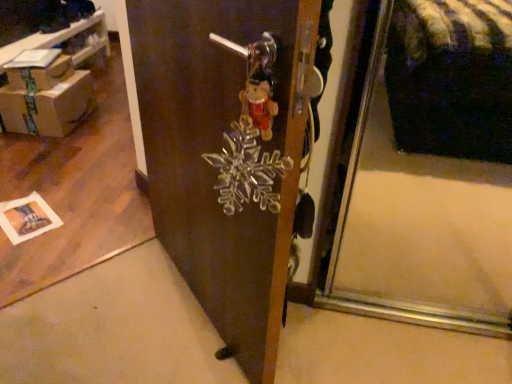
Image resolution: width=512 pixels, height=384 pixels. What do you see at coordinates (228, 154) in the screenshot?
I see `transparent glass snowflake at center` at bounding box center [228, 154].

What is the approximate width of brown cardboard box at upper left?

11.80 inches.

What are the coordinates of `transparent glass snowflake at center` in the screenshot? It's located at (228, 154).

In order to click on table below the brown cardboard box at upper left (from a real-world perspective) in this screenshot , I will do `click(61, 40)`.

From the picture: Between brown cardboard box at upper left and brown cardboard boxes at left, which one has smaller width?

With smaller width is brown cardboard box at upper left.

Is brown cardboard box at upper left next to brown cardboard boxes at left?

brown cardboard box at upper left and brown cardboard boxes at left are not in contact.

Looking at this image, considering the sizes of objects brown cardboard box at upper left and brown cardboard boxes at left in the image provided, who is smaller, brown cardboard box at upper left or brown cardboard boxes at left?

brown cardboard box at upper left is smaller.

Is transparent glass snowflake at center facing towards brown cardboard box at upper left?

No.

Identify the location of cardboard box that is under the transparent glass snowflake at center (from a real-world perspective). The height and width of the screenshot is (384, 512). (42, 74).

Can you confirm if transparent glass snowflake at center is bigger than brown cardboard box at upper left?

Correct, transparent glass snowflake at center is larger in size than brown cardboard box at upper left.

From the image's perspective, is transparent glass snowflake at center positioned above or below brown cardboard box at upper left?

Clearly, from the image's perspective, transparent glass snowflake at center is below brown cardboard box at upper left.

Can you tell me how much brown cardboard box at upper left and cardboard box at left differ in facing direction?

There is a 0.00053-degree angle between the facing directions of brown cardboard box at upper left and cardboard box at left.

Is brown cardboard box at upper left looking in the opposite direction of cardboard box at left?

No, brown cardboard box at upper left is not facing the opposite direction of cardboard box at left.

Is brown cardboard box at upper left not close to cardboard box at left?

No, brown cardboard box at upper left is not far away from cardboard box at left.

From a real-world perspective, relative to cardboard box at left, is transparent glass snowflake at center vertically above or below?

transparent glass snowflake at center is above cardboard box at left.

From the picture: Could you tell me if transparent glass snowflake at center is turned towards cardboard box at left?

No.

What's the angular difference between transparent glass snowflake at center and cardboard box at left's facing directions?

137 degrees separate the facing orientations of transparent glass snowflake at center and cardboard box at left.

How distant is transparent glass snowflake at center from cardboard box at left?

A distance of 5.16 feet exists between transparent glass snowflake at center and cardboard box at left.

Are cardboard box at left and transparent glass snowflake at center beside each other?

No, cardboard box at left is not making contact with transparent glass snowflake at center.

Could you tell me if cardboard box at left is facing transparent glass snowflake at center?

No, cardboard box at left is not aimed at transparent glass snowflake at center.

Which of these two, cardboard box at left or transparent glass snowflake at center, is smaller?

Smaller between the two is cardboard box at left.

Is transparent glass snowflake at center facing away from brown cardboard boxes at left?

No.

What's the angular difference between transparent glass snowflake at center and brown cardboard boxes at left's facing directions?

The angular difference between transparent glass snowflake at center and brown cardboard boxes at left is 137 degrees.

Is transparent glass snowflake at center situated inside brown cardboard boxes at left or outside?

The correct answer is: outside.

How much distance is there between transparent glass snowflake at center and brown cardboard boxes at left?

They are 1.95 meters apart.

From the image's perspective, would you say brown cardboard boxes at left is shown under transparent glass snowflake at center?

No, from the image's perspective, brown cardboard boxes at left is not beneath transparent glass snowflake at center.

Which point is more distant from viewer, (33, 44) or (296, 82)?

Point (33, 44)

From a real-world perspective, which object stands above the other?

transparent glass snowflake at center.

Locate an element on the screen. This screenshot has width=512, height=384. cardboard box below the brown cardboard boxes at left (from the image's perspective) is located at coordinates (42, 74).

Find the location of a particular element. cardboard box on the left of transparent glass snowflake at center is located at coordinates (42, 74).

Which object lies further to the anchor point brown cardboard boxes at left, brown cardboard box at upper left or transparent glass snowflake at center?

The object further to brown cardboard boxes at left is transparent glass snowflake at center.

From the image, which object appears to be farther from transparent glass snowflake at center, brown cardboard box at upper left or cardboard box at left?

brown cardboard box at upper left is positioned further to the anchor transparent glass snowflake at center.

When comparing their distances from transparent glass snowflake at center, does brown cardboard boxes at left or cardboard box at left seem further?

brown cardboard boxes at left is further to transparent glass snowflake at center.

Based on their spatial positions, is brown cardboard boxes at left or brown cardboard box at upper left further from cardboard box at left?

brown cardboard boxes at left lies further to cardboard box at left than the other object.

Based on the photo, when comparing their distances from brown cardboard box at upper left, does brown cardboard boxes at left or transparent glass snowflake at center seem closer?

brown cardboard boxes at left is closer to brown cardboard box at upper left.

Estimate the real-world distances between objects in this image. Which object is further from cardboard box at left, brown cardboard box at upper left or transparent glass snowflake at center?

Among the two, transparent glass snowflake at center is located further to cardboard box at left.

From the image, which object appears to be nearer to cardboard box at left, brown cardboard box at upper left or brown cardboard boxes at left?

brown cardboard box at upper left is positioned closer to the anchor cardboard box at left.

Based on their spatial positions, is brown cardboard boxes at left or cardboard box at left closer to brown cardboard box at upper left?

Based on the image, cardboard box at left appears to be nearer to brown cardboard box at upper left.

Where is `cardboard box situated between brown cardboard boxes at left and cardboard box at left from left to right`? This screenshot has width=512, height=384. cardboard box situated between brown cardboard boxes at left and cardboard box at left from left to right is located at coordinates (42, 74).

Image resolution: width=512 pixels, height=384 pixels. Find the location of `box between transparent glass snowflake at center and brown cardboard box at upper left along the z-axis`. box between transparent glass snowflake at center and brown cardboard box at upper left along the z-axis is located at coordinates (48, 107).

The width and height of the screenshot is (512, 384). Identify the location of table positioned between transparent glass snowflake at center and brown cardboard box at upper left from near to far. (61, 40).

Where is `table between transparent glass snowflake at center and cardboard box at left in the front-back direction`? The height and width of the screenshot is (384, 512). table between transparent glass snowflake at center and cardboard box at left in the front-back direction is located at coordinates (61, 40).